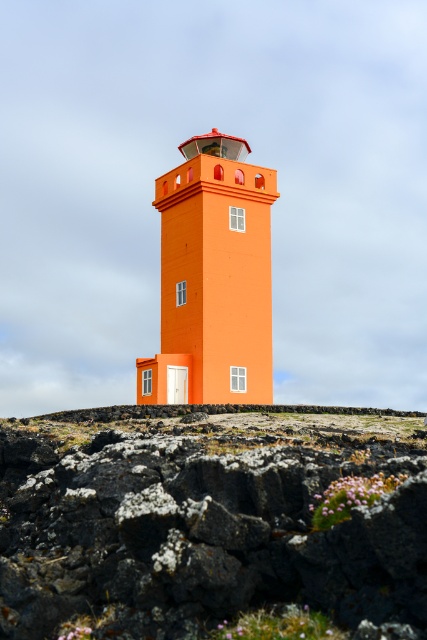
Looking at this image, you are standing at the base of the orange lighthouse and want to reach the point marked at coordinates (207, 520). According to the image, where is this point located?

The point marked at coordinates (207, 520) is located on the volcanic rock at center.